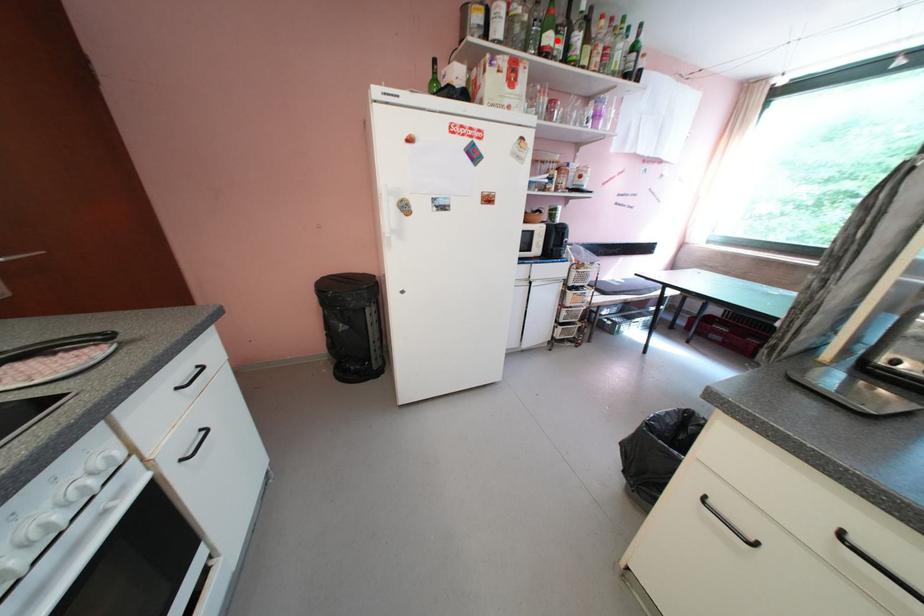
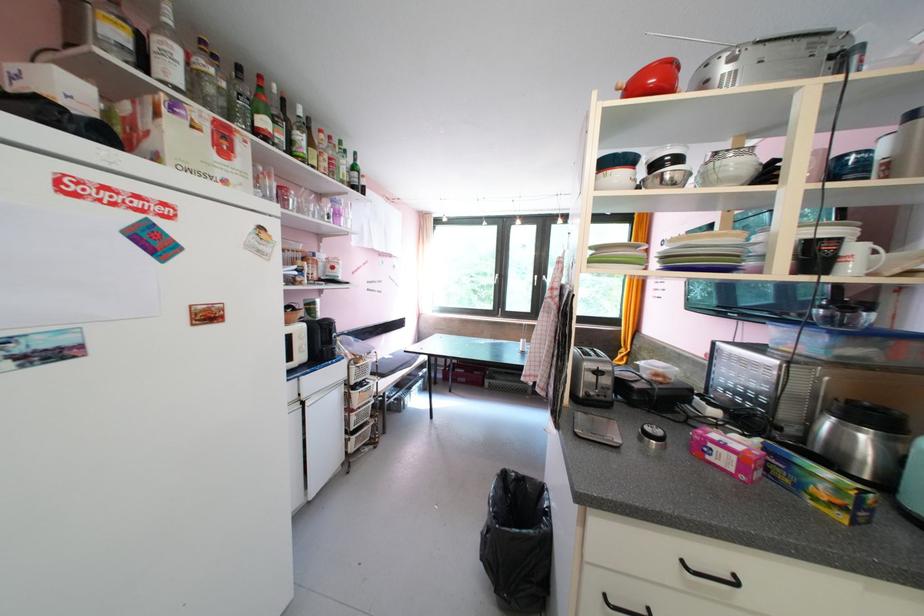
Locate, in the second image, the point that corresponds to the highlighted location in the first image.

(273, 124)